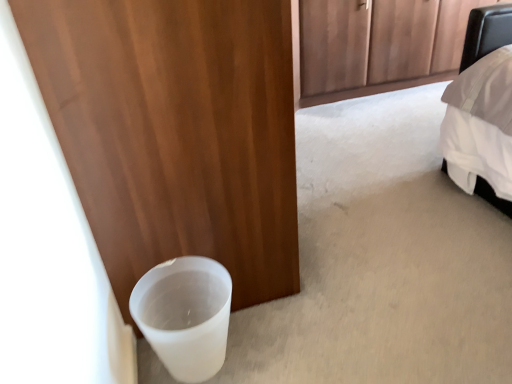
Question: Is white matte cup at lower left bigger or smaller than white matte door at lower left?

Choices:
 (A) big
 (B) small

Answer: (B)

Question: Is white matte cup at lower left spatially inside white matte door at lower left, or outside of it?

Choices:
 (A) outside
 (B) inside

Answer: (A)

Question: In terms of height, does white matte cup at lower left look taller or shorter compared to white matte door at lower left?

Choices:
 (A) tall
 (B) short

Answer: (B)

Question: Considering the relative positions of white matte door at lower left and white matte cup at lower left in the image provided, is white matte door at lower left to the left or to the right of white matte cup at lower left?

Choices:
 (A) right
 (B) left

Answer: (B)

Question: Considering their positions, is white matte door at lower left located in front of or behind white matte cup at lower left?

Choices:
 (A) behind
 (B) front

Answer: (B)

Question: Does point tap(229, 150) appear closer or farther from the camera than point tap(198, 329)?

Choices:
 (A) closer
 (B) farther

Answer: (B)

Question: From a real-world perspective, is white matte door at lower left positioned above or below white matte cup at lower left?

Choices:
 (A) above
 (B) below

Answer: (A)